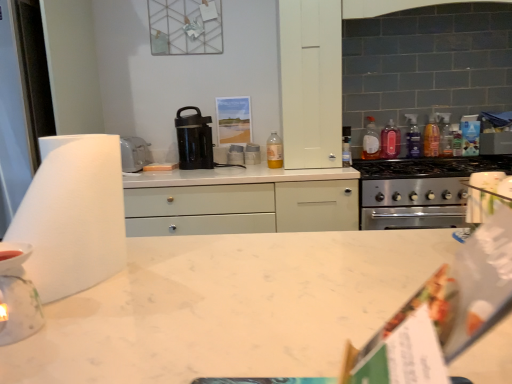
Question: Is white matte paper towel at left taller or shorter than stainless steel stove at right?

Choices:
 (A) tall
 (B) short

Answer: (A)

Question: From a real-world perspective, is white matte paper towel at left above or below stainless steel stove at right?

Choices:
 (A) above
 (B) below

Answer: (A)

Question: Which object is the closest to the white matte paper towel at left?

Choices:
 (A) translucent plastic bottle at upper center, positioned as the fifth bottle in right-to-left order
 (B) translucent plastic bottle at stove top, positioned as the second bottle in right-to-left order
 (C) translucent plastic bottle at upper right, acting as the 3th bottle starting from the right
 (D) white glossy stack of plates at center, arranged as the first appliance when viewed from the top
 (E) black plastic coffee maker at center

Answer: (E)

Question: Estimate the real-world distances between objects in this image. Which object is closer to the translucent plastic bottle at upper center, positioned as the fifth bottle in right-to-left order?

Choices:
 (A) stainless steel stove at right
 (B) white matte paper towel at left
 (C) black plastic coffee maker at center
 (D) translucent plastic bottle at upper right, the third bottle positioned from the left
 (E) porcelain tea light holder at lower left, which is the second appliance from right to left

Answer: (C)